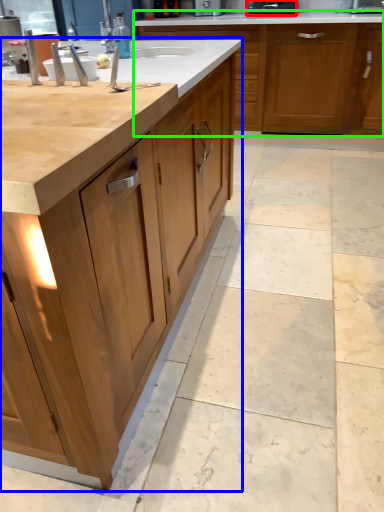
Question: Estimate the real-world distances between objects in this image. Which object is farther from appliance (highlighted by a red box), cabinetry (highlighted by a blue box) or cabinetry (highlighted by a green box)?

Choices:
 (A) cabinetry
 (B) cabinetry

Answer: (A)